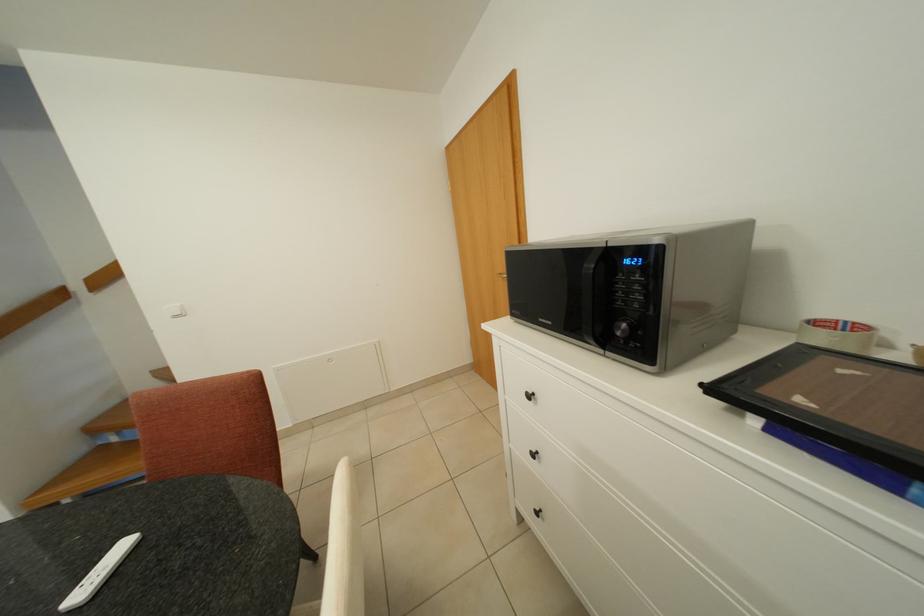
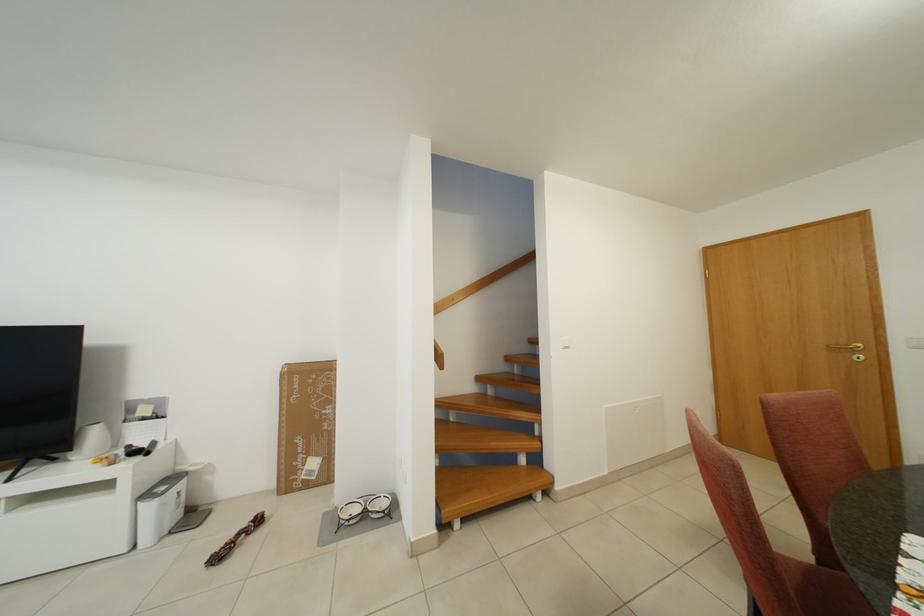
Question: Which direction would the cameraman need to move to produce the second image? Reply with the corresponding letter.

Choices:
 (A) Left
 (B) Right
 (C) Forward
 (D) Backward

Answer: (A)